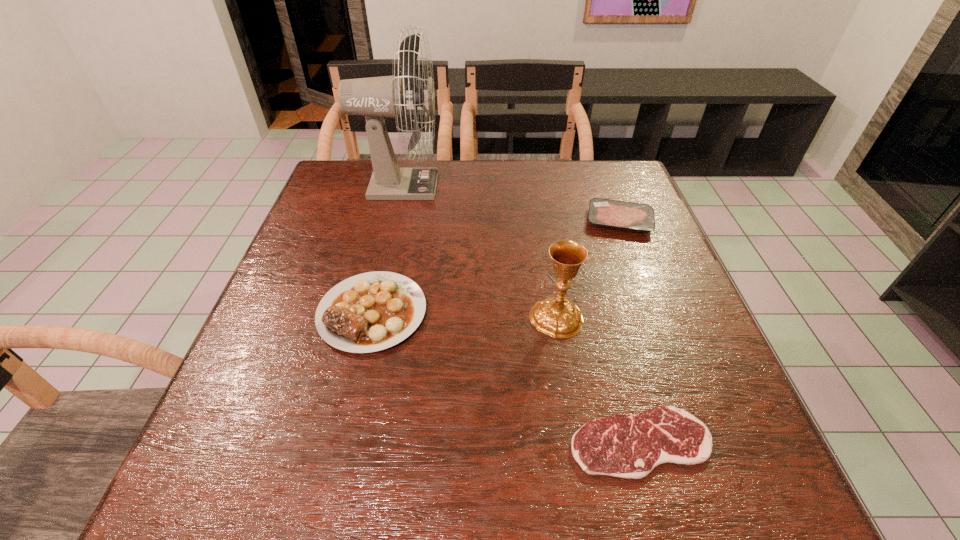
At what (x,y) coordinates should I click in order to perform the action: click on vacant space that satisfies the following two spatial constraints: 1. on the air flow direction of the tallest object; 2. on the back side of the nearest steak. Please return your answer as a coordinate pair (x, y). This screenshot has height=540, width=960. Looking at the image, I should click on (340, 442).

In order to click on free space that satisfies the following two spatial constraints: 1. on the air flow direction of the tallest object; 2. on the right side of the leftmost steak in this screenshot , I will do click(x=371, y=312).

Find the location of a particular element. This screenshot has height=540, width=960. free space that satisfies the following two spatial constraints: 1. on the air flow direction of the tallest object; 2. on the right side of the chalice is located at coordinates (370, 317).

Image resolution: width=960 pixels, height=540 pixels. I want to click on free location that satisfies the following two spatial constraints: 1. on the air flow direction of the tallest object; 2. on the back side of the second shortest steak, so click(393, 221).

This screenshot has width=960, height=540. What are the coordinates of `vacant space that satisfies the following two spatial constraints: 1. on the back side of the leftmost steak; 2. on the air flow direction of the tallest object` in the screenshot? It's located at (401, 186).